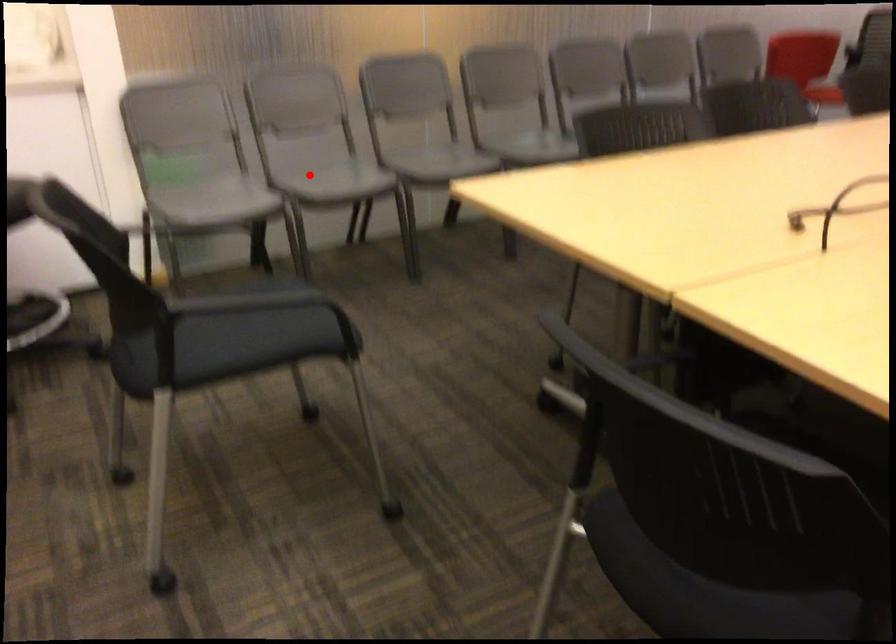
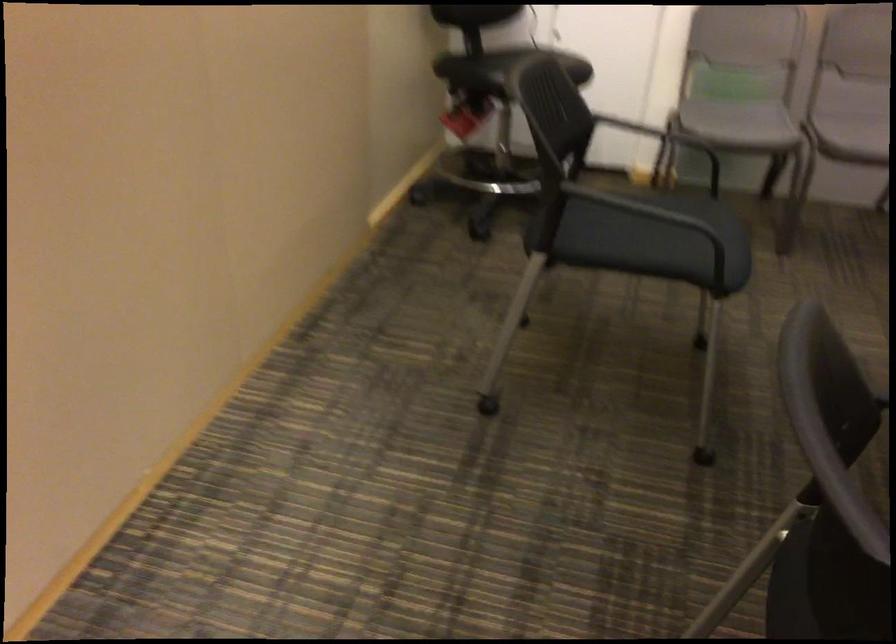
Where in the second image is the point corresponding to the highlighted location from the first image?

(853, 128)